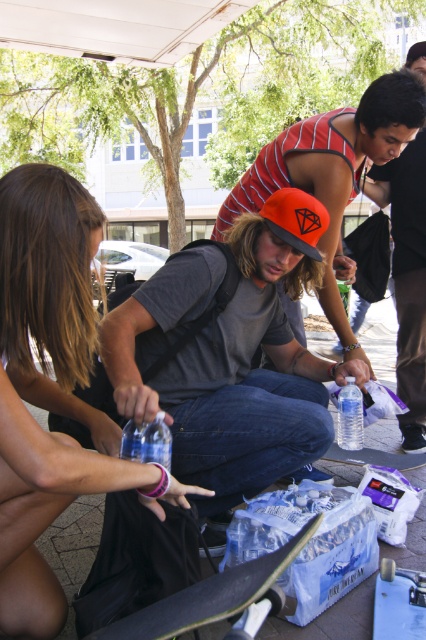
You are a photographer positioned at the center of the scene. You want to capture a photo that includes both the matte black hair at left and the smooth blue skateboard at lower right. Which object should you adjust your camera angle upward to include in the frame?

Since the matte black hair at left is taller than the smooth blue skateboard at lower right, you should adjust your camera angle upward to include the matte black hair at left.

You are a photographer trying to capture the scene from the current viewpoint. If you want to focus on the matte black hair at left without the smooth black skateboard at center overlapping, should you move forward or backward?

Since the matte black hair at left is closer to the viewer than the smooth black skateboard at center, moving forward would bring the hair into focus while moving the skateboard further away, reducing overlap. Therefore, moving forward would help avoid overlap.